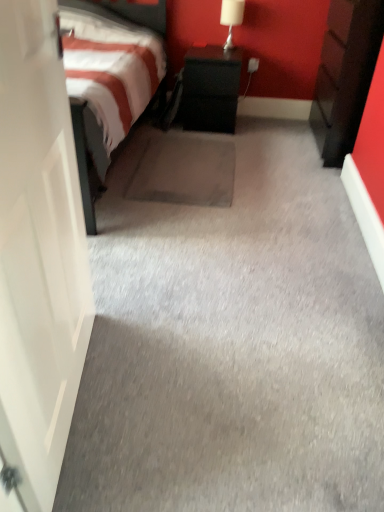
Question: In the image, is white glossy table lamp at upper right positioned in front of or behind black matte nightstand at center, the 1th nightstand in the left-to-right sequence?

Choices:
 (A) front
 (B) behind

Answer: (B)

Question: From a real-world perspective, is white glossy table lamp at upper right above or below black matte nightstand at center, the second nightstand in the right-to-left sequence?

Choices:
 (A) below
 (B) above

Answer: (B)

Question: Estimate the real-world distances between objects in this image. Which object is farther from the black matte nightstand at center, the second nightstand in the right-to-left sequence?

Choices:
 (A) white glossy table lamp at upper right
 (B) dark wood nightstand at right, the second nightstand from the left

Answer: (B)

Question: Estimate the real-world distances between objects in this image. Which object is farther from the black matte nightstand at center, the second nightstand in the right-to-left sequence?

Choices:
 (A) white glossy table lamp at upper right
 (B) dark wood nightstand at right, the second nightstand from the left

Answer: (B)